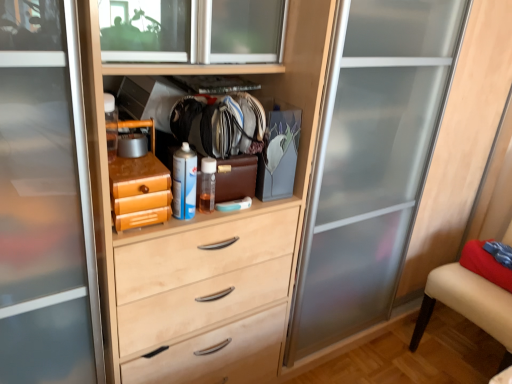
Question: Can you confirm if blue matte spray can at center is positioned to the left of beige fabric armchair at right?

Choices:
 (A) no
 (B) yes

Answer: (B)

Question: Is blue matte spray can at center smaller than beige fabric armchair at right?

Choices:
 (A) yes
 (B) no

Answer: (A)

Question: Is blue matte spray can at center completely or partially outside of beige fabric armchair at right?

Choices:
 (A) yes
 (B) no

Answer: (A)

Question: From a real-world perspective, does blue matte spray can at center stand above beige fabric armchair at right?

Choices:
 (A) no
 (B) yes

Answer: (B)

Question: From a real-world perspective, is blue matte spray can at center located beneath beige fabric armchair at right?

Choices:
 (A) no
 (B) yes

Answer: (A)

Question: Considering the relative positions of blue matte spray can at center and beige fabric armchair at right in the image provided, is blue matte spray can at center to the right of beige fabric armchair at right from the viewer's perspective?

Choices:
 (A) no
 (B) yes

Answer: (A)

Question: Does beige fabric armchair at right have a greater height compared to blue matte spray can at center?

Choices:
 (A) yes
 (B) no

Answer: (A)

Question: Would you say beige fabric armchair at right is a long distance from blue matte spray can at center?

Choices:
 (A) no
 (B) yes

Answer: (B)

Question: Is blue matte spray can at center completely or partially inside beige fabric armchair at right?

Choices:
 (A) yes
 (B) no

Answer: (B)

Question: Considering the relative positions of beige fabric armchair at right and blue matte spray can at center in the image provided, is beige fabric armchair at right to the right of blue matte spray can at center from the viewer's perspective?

Choices:
 (A) yes
 (B) no

Answer: (A)

Question: Can you confirm if beige fabric armchair at right is smaller than blue matte spray can at center?

Choices:
 (A) yes
 (B) no

Answer: (B)

Question: Is beige fabric armchair at right positioned behind blue matte spray can at center?

Choices:
 (A) no
 (B) yes

Answer: (B)

Question: In terms of height, does blue matte spray can at center look taller or shorter compared to beige fabric armchair at right?

Choices:
 (A) tall
 (B) short

Answer: (B)